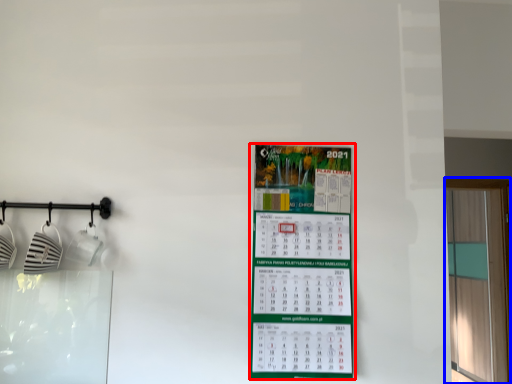
Question: Which point is closer to the camera, poster (highlighted by a red box) or window (highlighted by a blue box)?

Choices:
 (A) poster
 (B) window

Answer: (A)